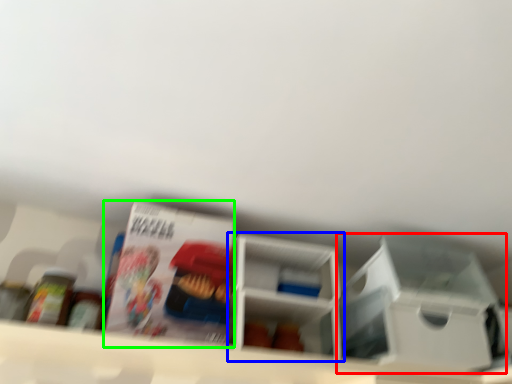
Question: Which is farther away from storage box (highlighted by a red box)? shelf (highlighted by a blue box) or magazine (highlighted by a green box)?

Choices:
 (A) shelf
 (B) magazine

Answer: (B)